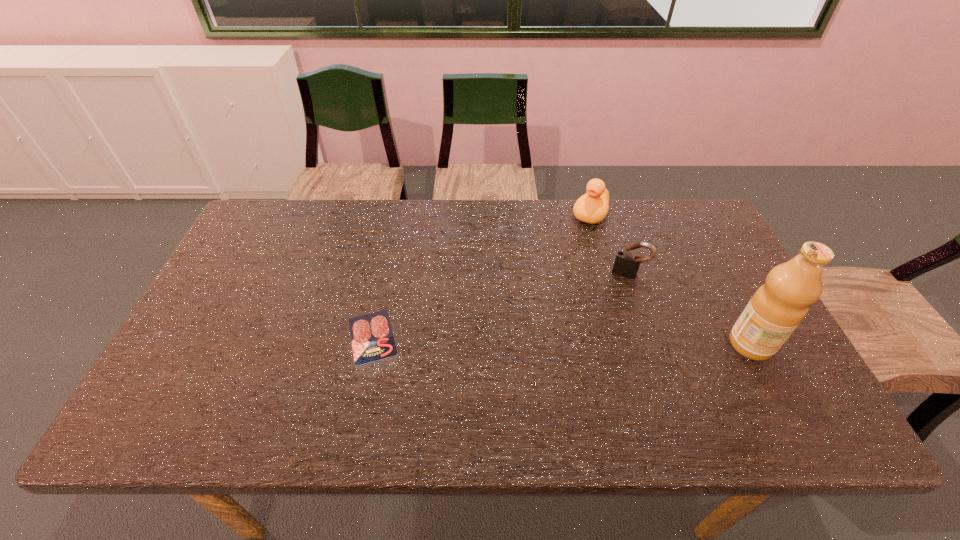
What are the coordinates of `vacant space on the desktop that is between the salami and the rightmost object and is positioned with the keyhole on the front of the padlock` in the screenshot? It's located at (607, 341).

Where is `vacant space on the desktop that is between the leftmost object and the olive oil and is positioned on the face of the farthest object`? vacant space on the desktop that is between the leftmost object and the olive oil and is positioned on the face of the farthest object is located at coordinates (513, 339).